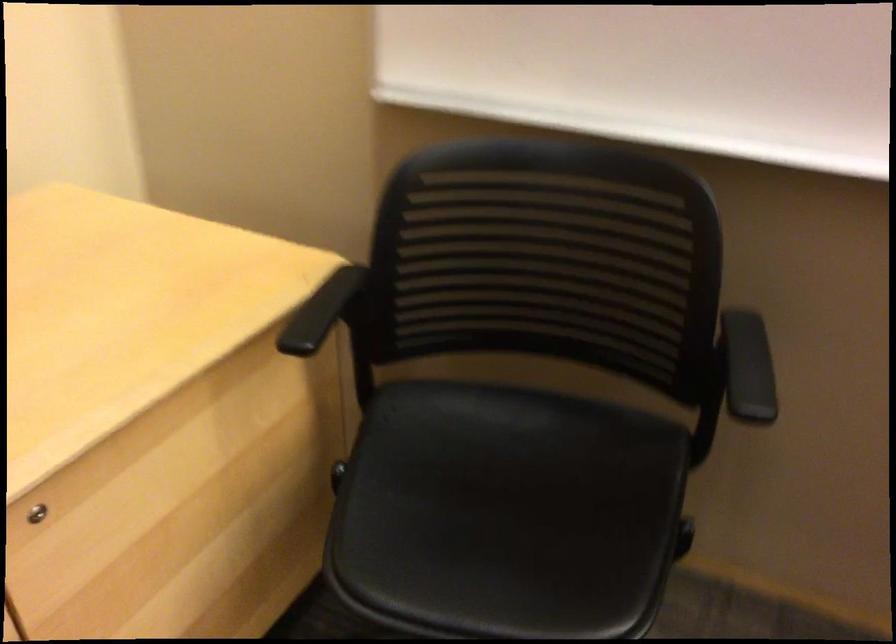
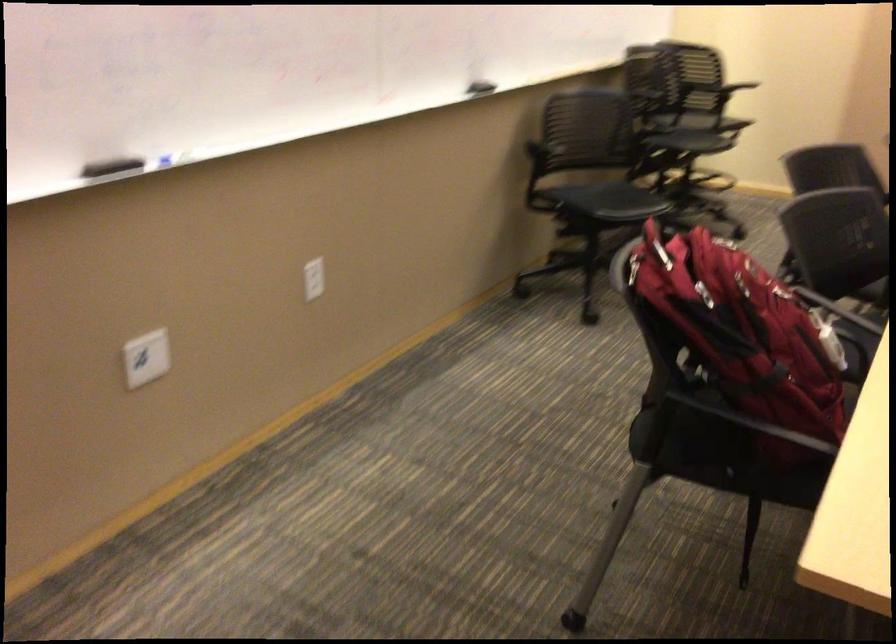
First-person continuous shooting, in which direction is the camera rotating?

The camera rotated toward right-down.